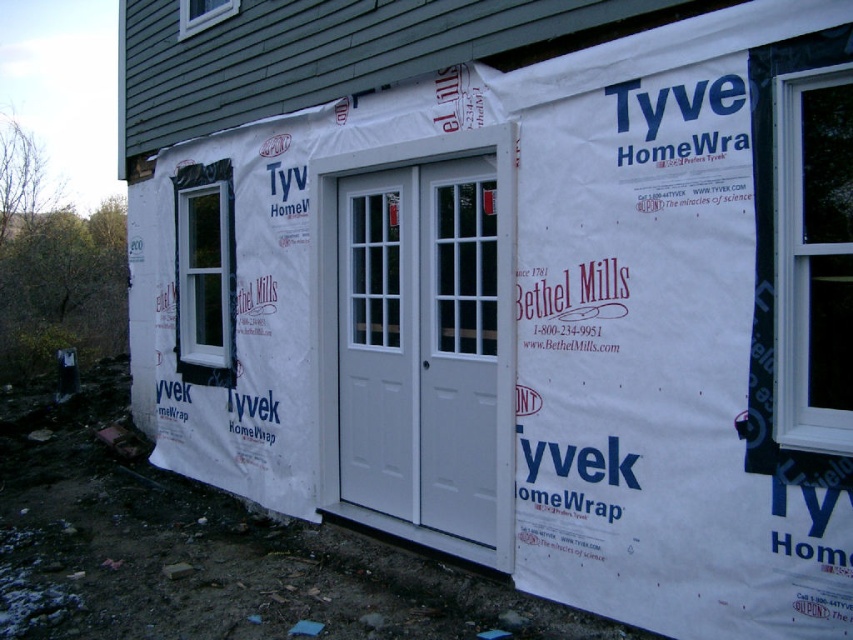
Question: Which is farther from the white plastic window at right?

Choices:
 (A) white smooth window at left
 (B) white painted wood screen door at center

Answer: (A)

Question: Estimate the real-world distances between objects in this image. Which object is farther from the white plastic window at upper left?

Choices:
 (A) white painted wood screen door at center
 (B) white plastic window at right
 (C) white smooth window at left

Answer: (B)

Question: Is white plastic window at right thinner than white plastic window at upper left?

Choices:
 (A) no
 (B) yes

Answer: (B)

Question: Is white painted wood screen door at center to the right of white plastic window at upper left from the viewer's perspective?

Choices:
 (A) yes
 (B) no

Answer: (A)

Question: Can you confirm if white plastic window at right is positioned to the right of white plastic window at upper left?

Choices:
 (A) yes
 (B) no

Answer: (A)

Question: Which is farther from the white plastic window at upper left?

Choices:
 (A) white painted wood screen door at center
 (B) white plastic window at right
 (C) white smooth window at left

Answer: (B)